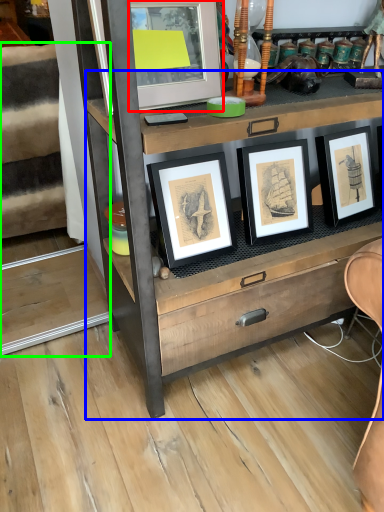
Question: Considering the real-world distances, which object is closest to picture frame (highlighted by a red box)? chest of drawers (highlighted by a blue box) or stairwell (highlighted by a green box).

Choices:
 (A) chest of drawers
 (B) stairwell

Answer: (A)